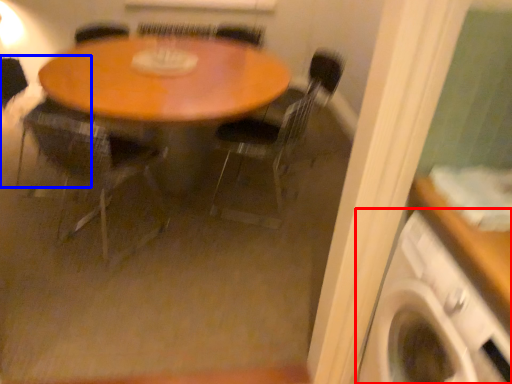
Question: Which object is closer to the camera taking this photo, washing machine (highlighted by a red box) or armchair (highlighted by a blue box)?

Choices:
 (A) washing machine
 (B) armchair

Answer: (A)